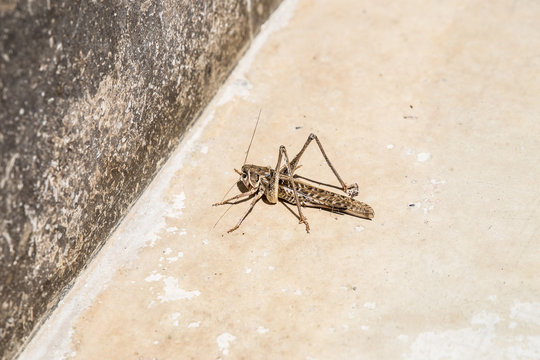
In order to click on floor behind bug in this screenshot , I will do `click(472, 248)`.